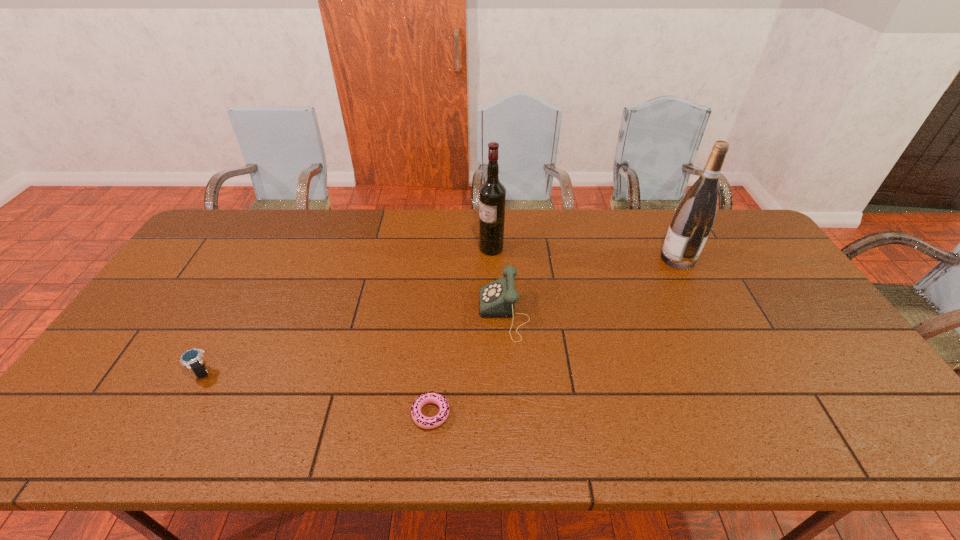
I want to click on the right wine bottle, so click(693, 219).

What are the coordinates of `the left wine bottle` in the screenshot? It's located at (492, 194).

The width and height of the screenshot is (960, 540). Identify the location of the third tallest object. (497, 299).

The width and height of the screenshot is (960, 540). I want to click on the third nearest object, so click(497, 299).

Locate an element on the screen. This screenshot has height=540, width=960. watch is located at coordinates (192, 358).

Where is `the fourth farthest object`? This screenshot has height=540, width=960. the fourth farthest object is located at coordinates (192, 358).

You are a GUI agent. You are given a task and a screenshot of the screen. Output one action in this format:
    pyautogui.click(x=<x>, y=<y>)
    Task: Click on the doughnut
    This screenshot has height=540, width=960.
    Given the screenshot: What is the action you would take?
    pyautogui.click(x=432, y=397)

You are a GUI agent. You are given a task and a screenshot of the screen. Output one action in this format:
    pyautogui.click(x=<x>, y=<y>)
    Task: Click on the nearest object
    This screenshot has width=960, height=540.
    Given the screenshot: What is the action you would take?
    pyautogui.click(x=432, y=397)

I want to click on blank space located 0.100m on the label of the right wine bottle, so click(x=630, y=259).

Locate an element on the screen. This screenshot has height=540, width=960. vacant space situated on the label of the right wine bottle is located at coordinates (538, 259).